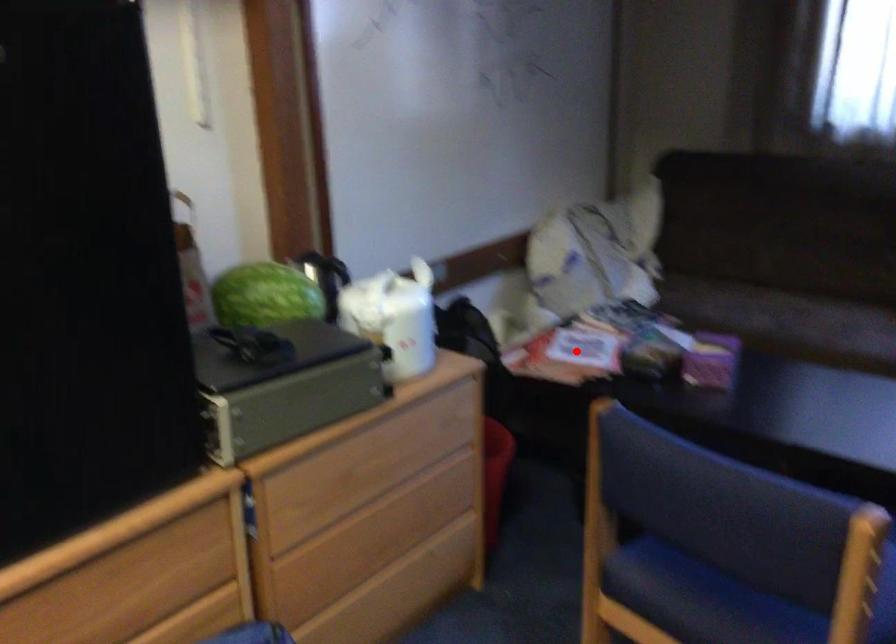
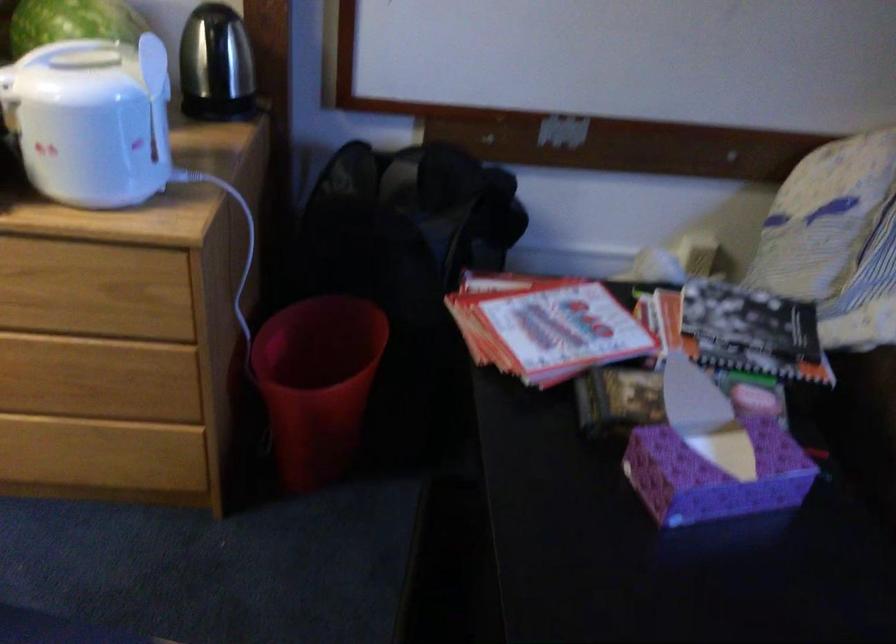
In the second image, find the point that corresponds to the highlighted location in the first image.

(545, 326)